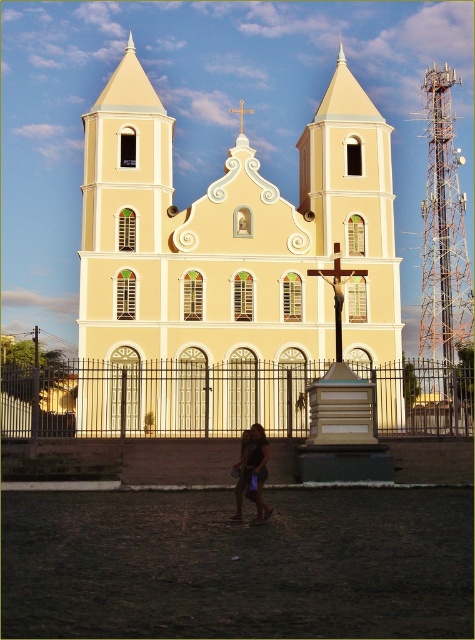
You are standing at the entrance of the church and want to take a photo of the orange metallic tower at right. Which direction should you face to capture it in your camera view?

The orange metallic tower at right is located at coordinates 0.361 on the x axis and 0.933 on the y axis, so you should face towards the right side of the scene to capture it in your camera view.